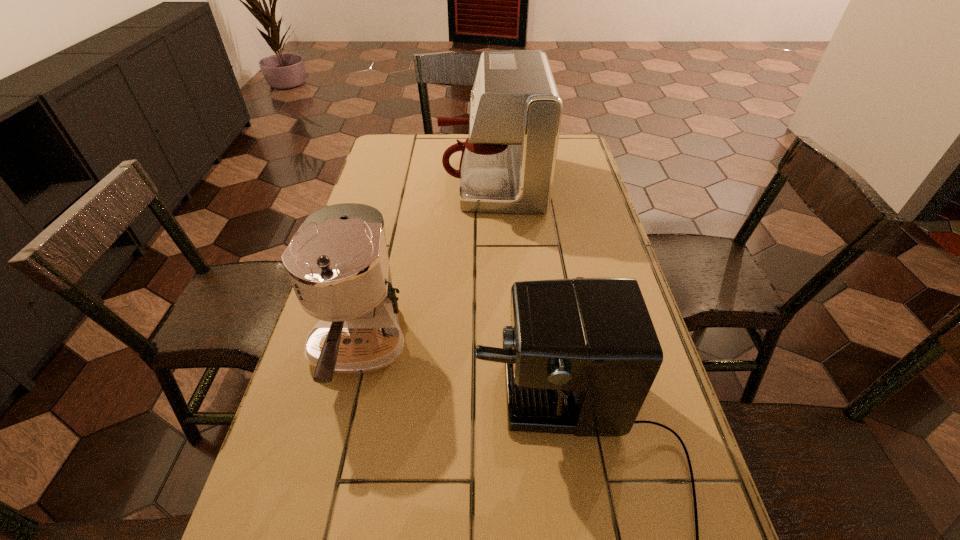
Where is `vacant area at the left edge`? vacant area at the left edge is located at coordinates (300, 539).

Where is `vacant space at the right edge`? The height and width of the screenshot is (540, 960). vacant space at the right edge is located at coordinates (599, 271).

Find the location of a particular element. This screenshot has height=540, width=960. vacant space at the far right corner is located at coordinates (583, 158).

Find the location of a particular element. The width and height of the screenshot is (960, 540). free space between the farthest coffee maker and the leftmost coffee maker is located at coordinates (425, 265).

Locate an element on the screen. vacant space that is in between the farthest coffee maker and the second shortest object is located at coordinates tap(425, 265).

Find the location of a particular element. The height and width of the screenshot is (540, 960). free space between the leftmost coffee maker and the farthest object is located at coordinates (425, 265).

Find the location of `vacant area that lies between the tallest coffee maker and the leftmost object`. vacant area that lies between the tallest coffee maker and the leftmost object is located at coordinates (425, 265).

In order to click on free space between the leftmost coffee maker and the farthest coffee maker in this screenshot , I will do `click(425, 265)`.

Where is `object identified as the closest to the tallest object`? Image resolution: width=960 pixels, height=540 pixels. object identified as the closest to the tallest object is located at coordinates (338, 264).

Select which object appears as the second closest to the tallest object. Please provide its 2D coordinates. Your answer should be formatted as a tuple, i.e. [(x, y)], where the tuple contains the x and y coordinates of a point satisfying the conditions above.

[(585, 353)]